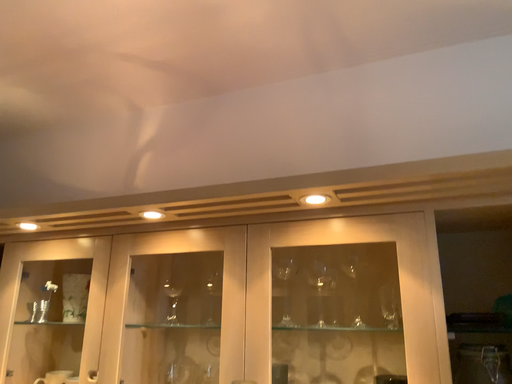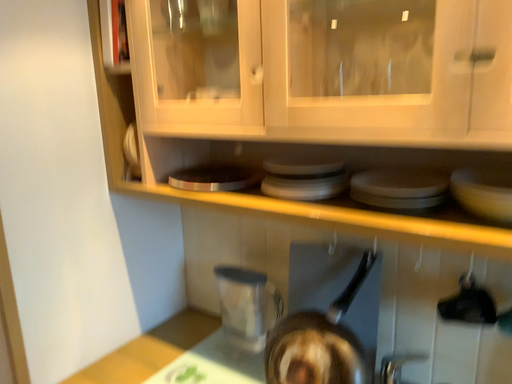
Question: How did the camera likely rotate when shooting the video?

Choices:
 (A) rotated upward
 (B) rotated downward

Answer: (B)